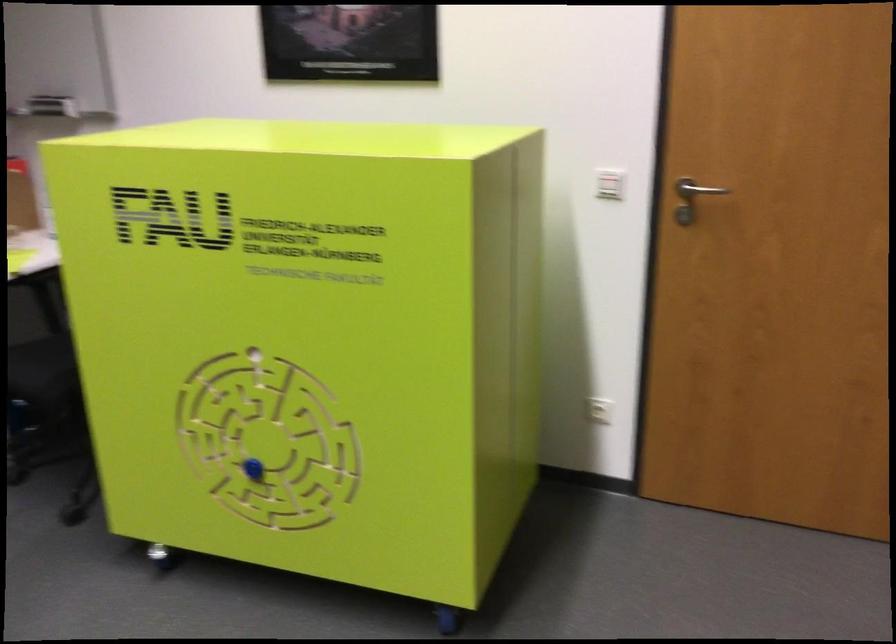
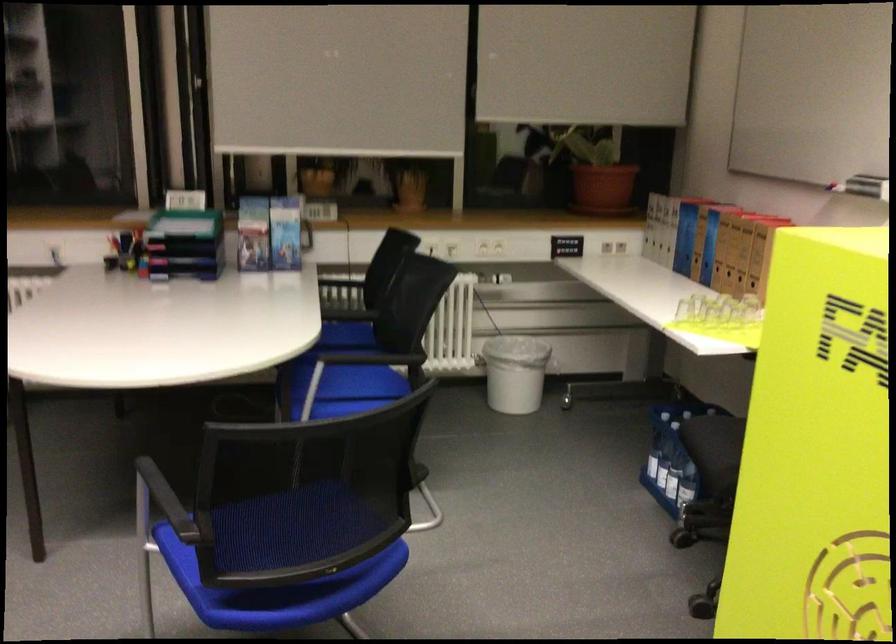
Question: The camera is either moving clockwise (left) or counter-clockwise (right) around the object. The first image is from the beginning of the video and the second image is from the end. Is the camera moving left or right when shooting the video?

Choices:
 (A) Left
 (B) Right

Answer: (B)